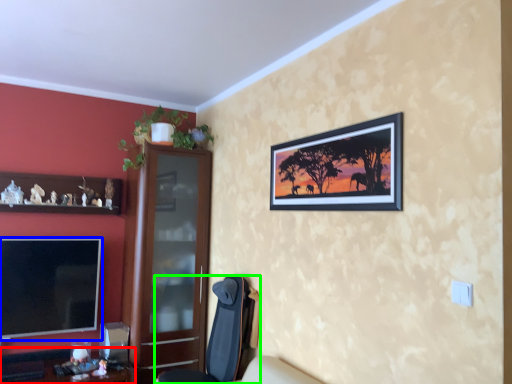
Question: Considering the real-world distances, which object is farthest from desk (highlighted by a red box)? television (highlighted by a blue box) or chair (highlighted by a green box)?

Choices:
 (A) television
 (B) chair

Answer: (B)